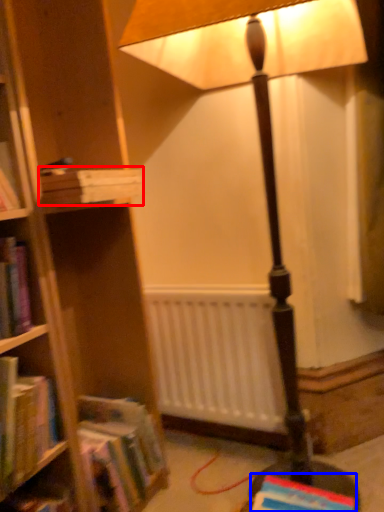
Question: Which point is closer to the camera, book (highlighted by a red box) or book (highlighted by a blue box)?

Choices:
 (A) book
 (B) book

Answer: (B)